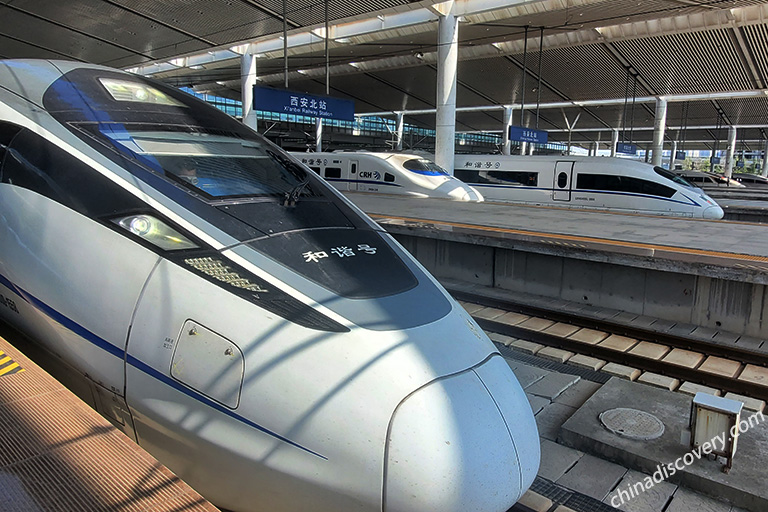
This screenshot has height=512, width=768. I want to click on column structures, so click(442, 73), click(245, 102), click(657, 127), click(502, 118), click(730, 143).